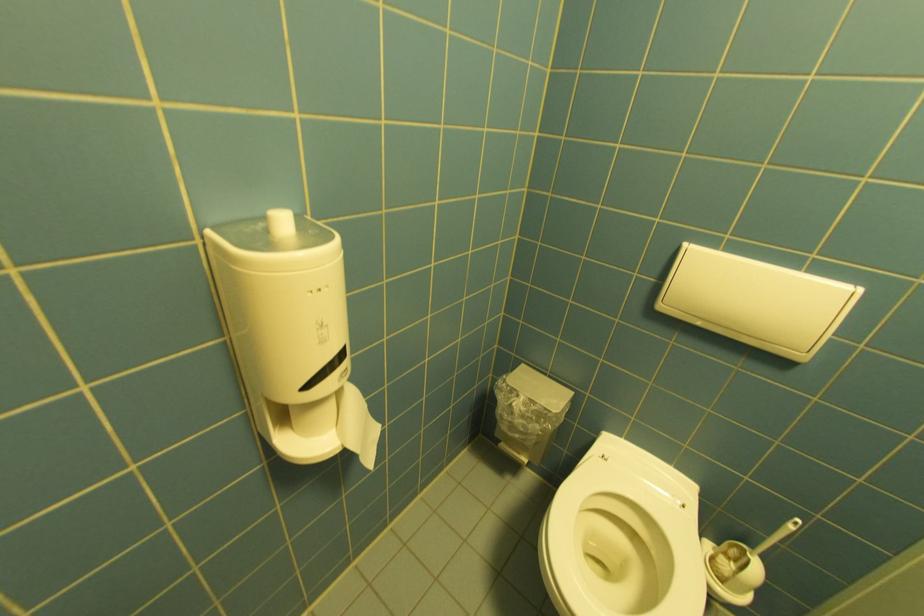
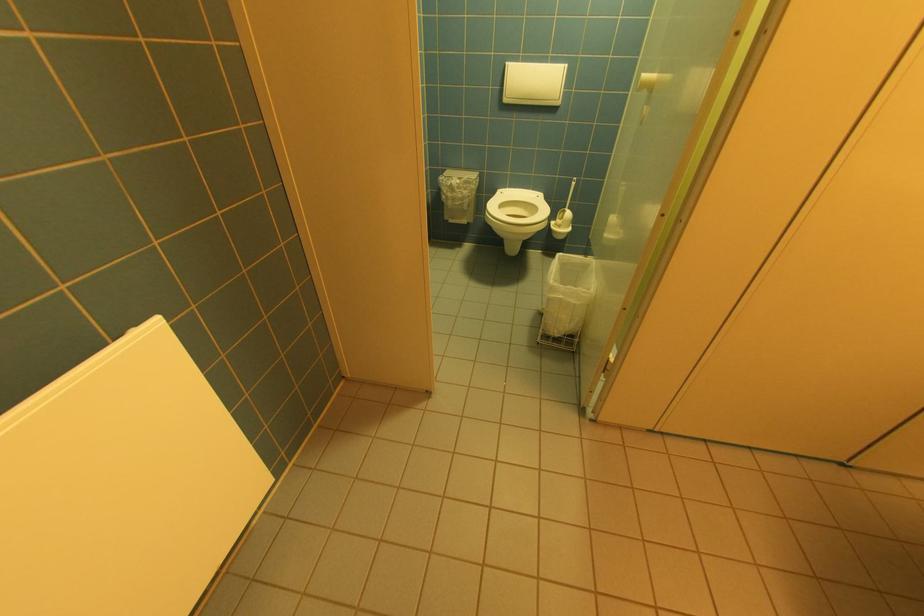
In the second image, find the point that corresponds to (x=666, y=308) in the first image.

(512, 100)